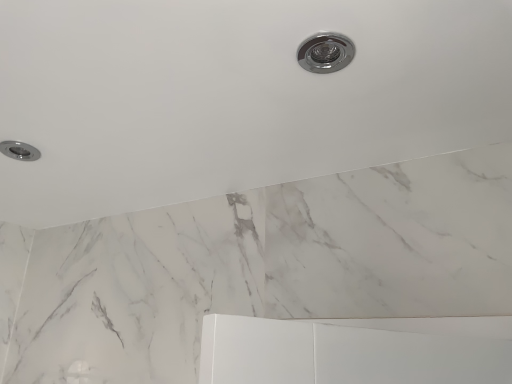
Question: Visually, is chrome/metallic recessed light at upper center positioned to the left or to the right of satin chrome light fixture at upper left?

Choices:
 (A) right
 (B) left

Answer: (A)

Question: Choose the correct answer: Is chrome/metallic recessed light at upper center inside satin chrome light fixture at upper left or outside it?

Choices:
 (A) inside
 (B) outside

Answer: (B)

Question: From the image's perspective, is chrome/metallic recessed light at upper center above or below satin chrome light fixture at upper left?

Choices:
 (A) above
 (B) below

Answer: (A)

Question: Considering the positions of satin chrome light fixture at upper left and chrome/metallic recessed light at upper center in the image, is satin chrome light fixture at upper left taller or shorter than chrome/metallic recessed light at upper center?

Choices:
 (A) tall
 (B) short

Answer: (A)

Question: From a real-world perspective, relative to chrome/metallic recessed light at upper center, is satin chrome light fixture at upper left vertically above or below?

Choices:
 (A) above
 (B) below

Answer: (A)

Question: Based on their sizes in the image, would you say satin chrome light fixture at upper left is bigger or smaller than chrome/metallic recessed light at upper center?

Choices:
 (A) small
 (B) big

Answer: (B)

Question: In the image, is satin chrome light fixture at upper left positioned in front of or behind chrome/metallic recessed light at upper center?

Choices:
 (A) front
 (B) behind

Answer: (B)